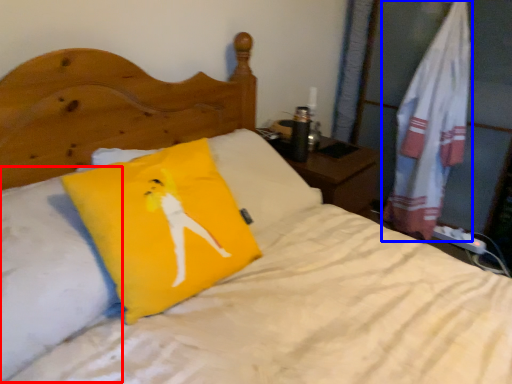
Question: Which of the following is the farthest to the observer, pillow (highlighted by a red box) or material (highlighted by a blue box)?

Choices:
 (A) pillow
 (B) material

Answer: (B)